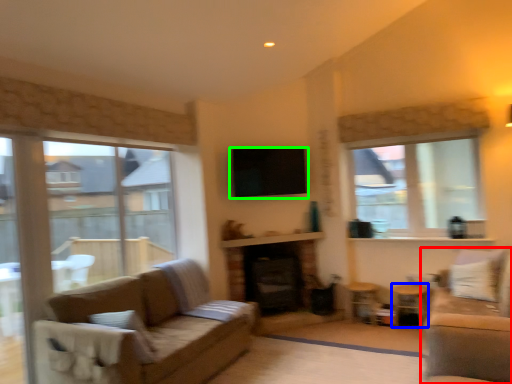
Question: Which object is positioned closest to studio couch (highlighted by a red box)? Select from side table (highlighted by a blue box) and window screen (highlighted by a green box).

Choices:
 (A) side table
 (B) window screen

Answer: (A)